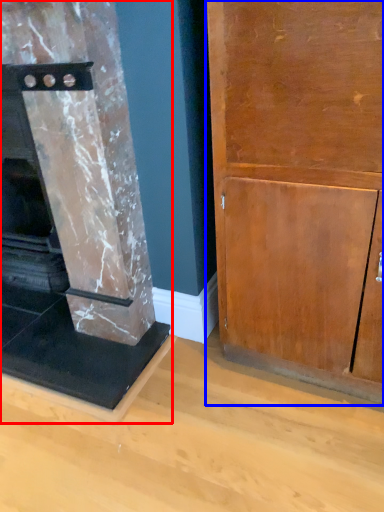
Question: Among these objects, which one is nearest to the camera, fireplace (highlighted by a red box) or cupboard (highlighted by a blue box)?

Choices:
 (A) fireplace
 (B) cupboard

Answer: (B)